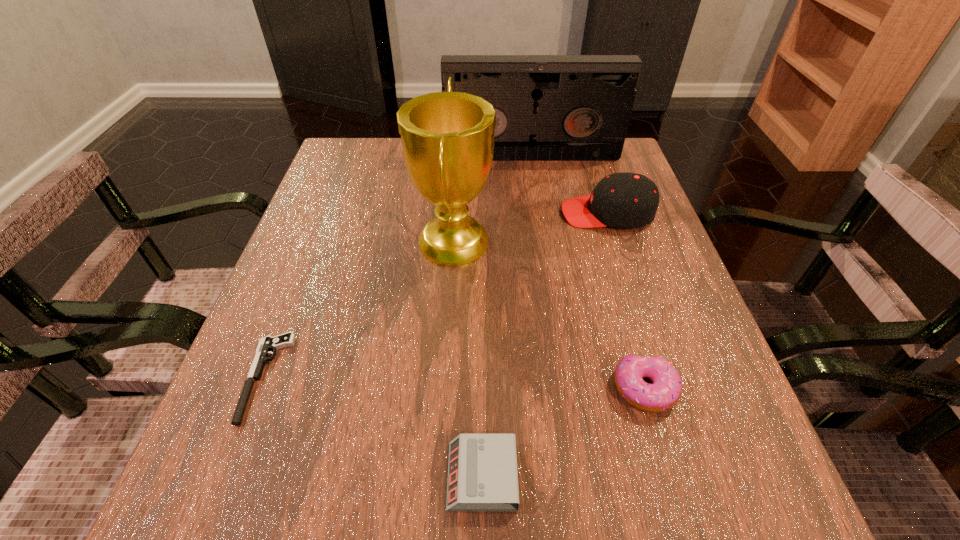
Where is `the tallest object`? the tallest object is located at coordinates (447, 137).

Where is `videotape`? videotape is located at coordinates (548, 107).

At what (x,y) coordinates should I click in order to perform the action: click on the farthest object. Please return your answer as a coordinate pair (x, y). Looking at the image, I should click on (548, 107).

You are a GUI agent. You are given a task and a screenshot of the screen. Output one action in this format:
    pyautogui.click(x=<x>, y=<y>)
    Task: Click on the third tallest object
    The width and height of the screenshot is (960, 540).
    Given the screenshot: What is the action you would take?
    pyautogui.click(x=622, y=200)

Find the location of `doughnut`. doughnut is located at coordinates (665, 392).

Where is `the nearest object`? Image resolution: width=960 pixels, height=540 pixels. the nearest object is located at coordinates (482, 470).

At what (x,y) coordinates should I click in order to perform the action: click on alarm clock. Please return your answer as a coordinate pair (x, y). The width and height of the screenshot is (960, 540). Looking at the image, I should click on (482, 470).

The image size is (960, 540). Find the location of `the shortest object`. the shortest object is located at coordinates (266, 344).

Find the location of a particular element. The height and width of the screenshot is (540, 960). pistol is located at coordinates (266, 344).

Image resolution: width=960 pixels, height=540 pixels. What are the coordinates of `vacant region located 0.240m on the shiny surface of the tallest object` in the screenshot? It's located at (606, 240).